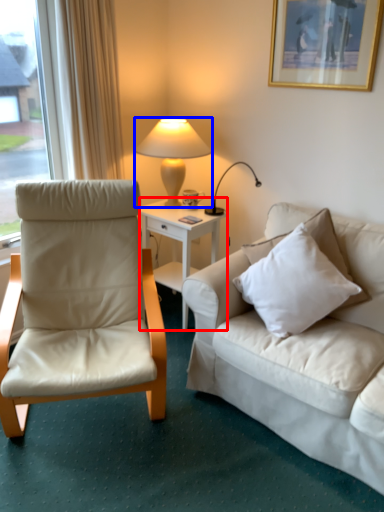
Question: Which object appears farthest to the camera in this image, desk (highlighted by a red box) or lamp (highlighted by a blue box)?

Choices:
 (A) desk
 (B) lamp

Answer: (A)